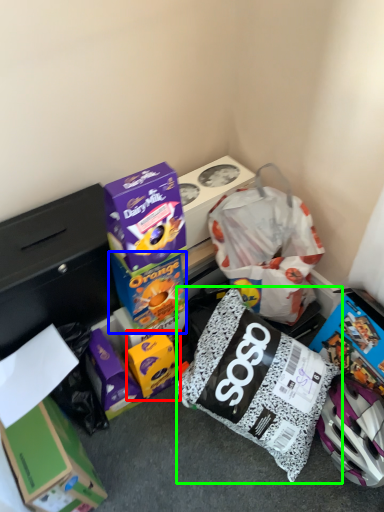
Question: Based on their relative distances, which object is nearer to box (highlighted by a red box)? Choose from box (highlighted by a blue box) and diaper bag (highlighted by a green box).

Choices:
 (A) box
 (B) diaper bag

Answer: (A)